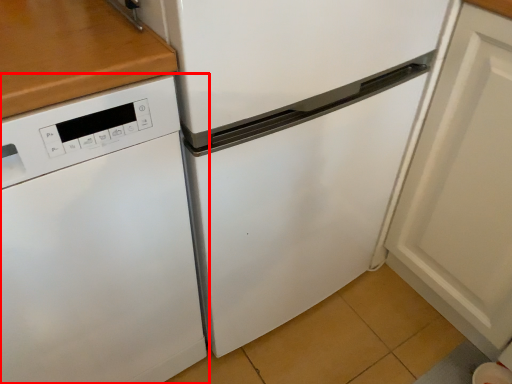
Question: From the image's perspective, what is the correct spatial positioning of home appliance (annotated by the red box) in reference to door?

Choices:
 (A) above
 (B) below

Answer: (B)